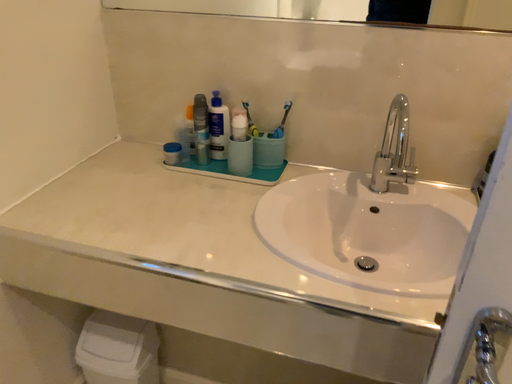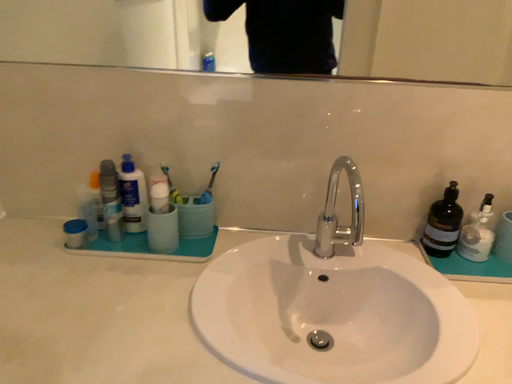
Question: How did the camera likely rotate when shooting the video?

Choices:
 (A) rotated right
 (B) rotated left

Answer: (A)